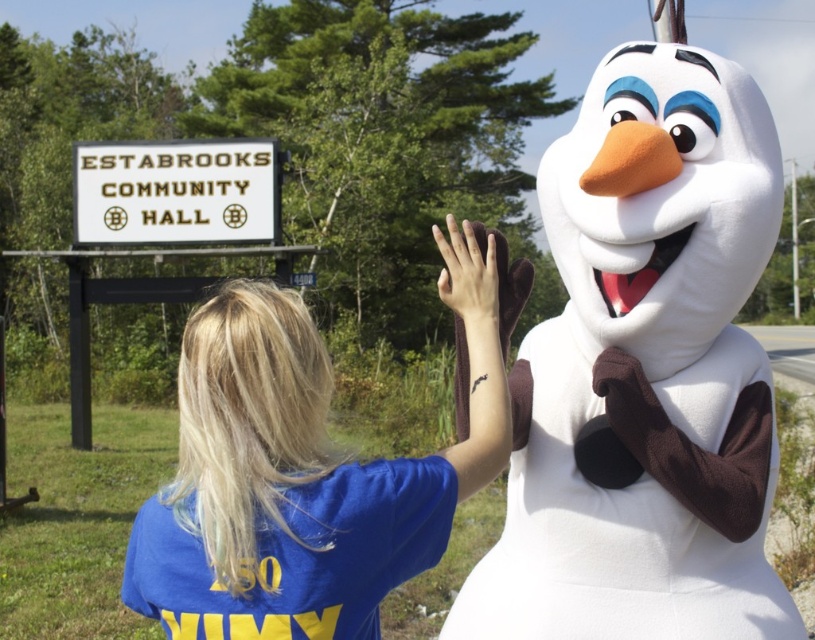
Is white plush snowman at center further to the viewer compared to blue cotton shirt at center?

Yes, white plush snowman at center is further from the viewer.

This screenshot has width=815, height=640. What are the coordinates of `white plush snowman at center` in the screenshot? It's located at (645, 372).

Which is in front, point (628, 618) or point (201, 349)?

Point (201, 349) is more forward.

At what (x,y) coordinates should I click in order to perform the action: click on white plush snowman at center. Please return your answer as a coordinate pair (x, y). Looking at the image, I should click on [645, 372].